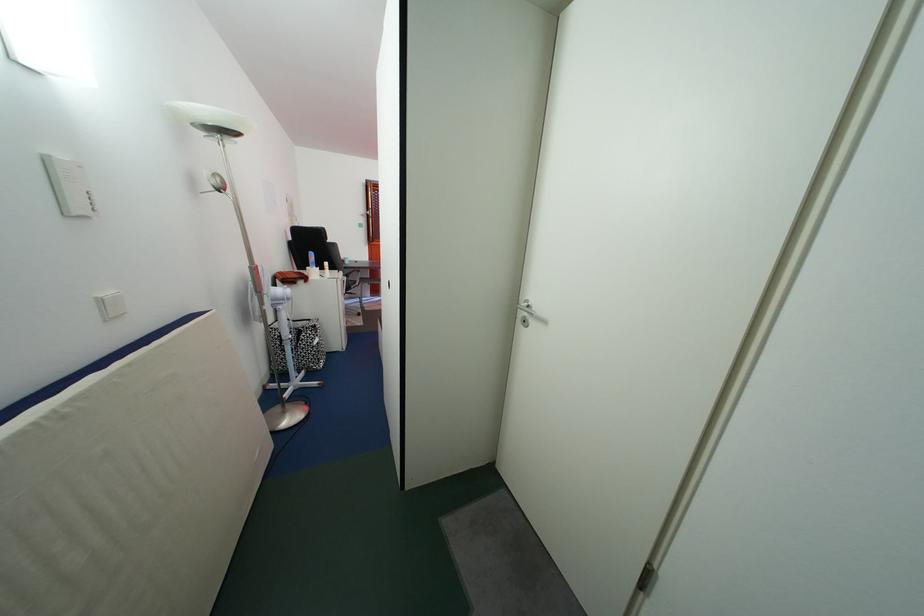
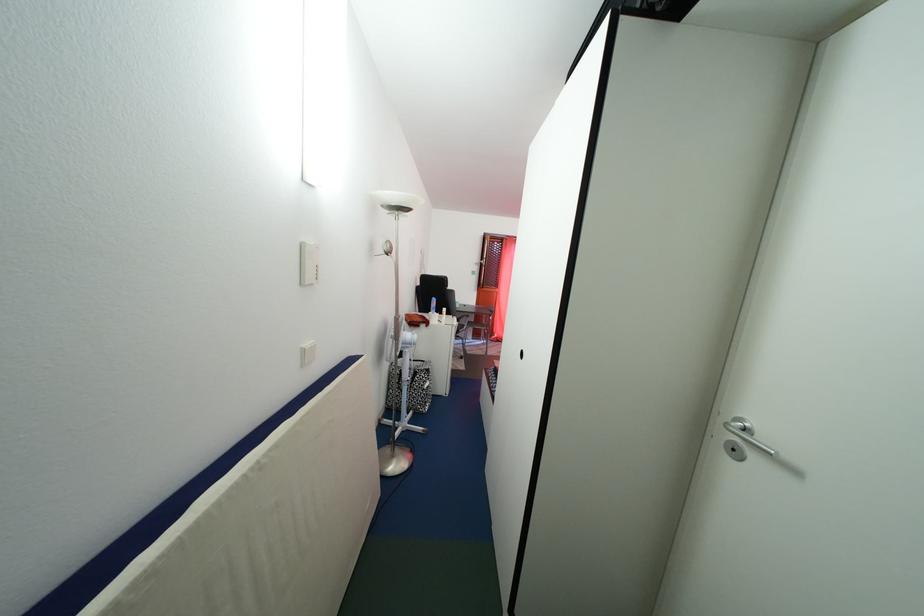
In the second image, find the point that corresponds to pixel 55 167 in the first image.

(310, 253)